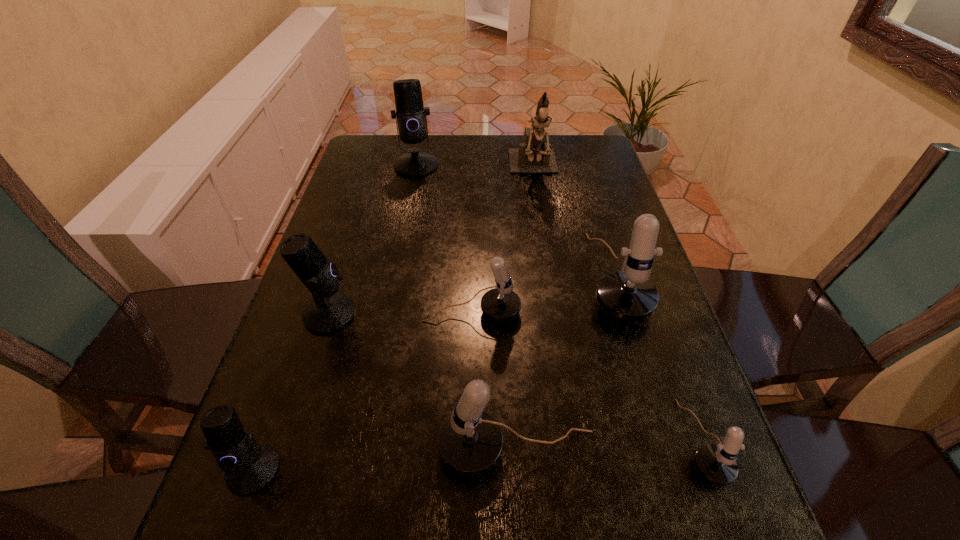
Where is `free spot located 0.330m on the front-facing side of the figurine`? free spot located 0.330m on the front-facing side of the figurine is located at coordinates (549, 267).

Locate an element on the screen. free space located 0.170m on the stand of the biggest black microphone is located at coordinates (407, 211).

Find the location of a particular element. vacant space located on the front of the biggest white microphone is located at coordinates (637, 354).

Image resolution: width=960 pixels, height=540 pixels. What are the coordinates of `free space located 0.360m on the stand of the second nearest black microphone` in the screenshot? It's located at (517, 314).

Find the location of a particular element. The image size is (960, 540). free spot located 0.190m on the left of the second biggest white microphone is located at coordinates (328, 450).

Where is `vacant space positioned 0.210m on the right of the third biggest white microphone`? vacant space positioned 0.210m on the right of the third biggest white microphone is located at coordinates (614, 313).

The height and width of the screenshot is (540, 960). I want to click on free point located on the back of the shortest microphone, so click(x=656, y=318).

Where is `figurine that is at the far edge`? figurine that is at the far edge is located at coordinates (533, 156).

Find the location of `microphone at the far edge`. microphone at the far edge is located at coordinates (411, 115).

Where is `object that is at the far left corner`? object that is at the far left corner is located at coordinates (411, 115).